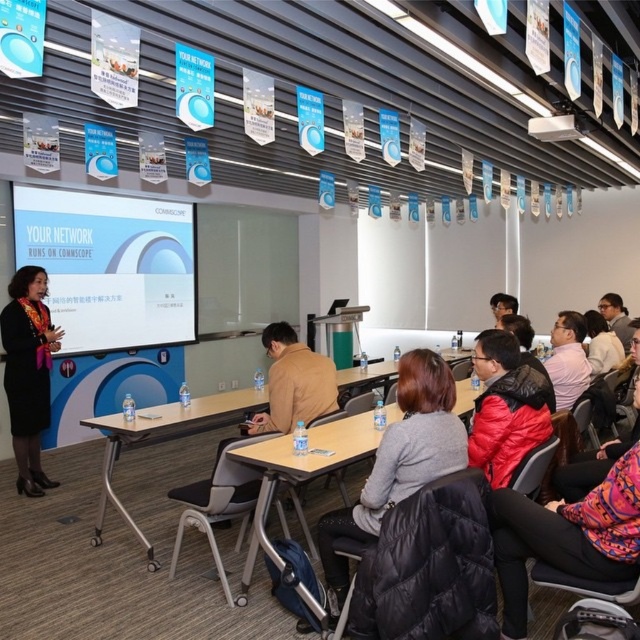
Question: Which point is farther to the camera?

Choices:
 (A) pink fabric shirt at center
 (B) metallic projector at upper center
 (C) wooden table at center
 (D) patterned fabric jacket at lower right

Answer: (B)

Question: Which object is closer to the camera taking this photo?

Choices:
 (A) light brown wooden table at center
 (B) black fabric dress at lower left

Answer: (A)

Question: Which of these objects is positioned farthest from the white glossy projection screen at center?

Choices:
 (A) metallic projector at upper center
 (B) pink fabric shirt at center
 (C) light brown wooden table at center
 (D) wooden table at center

Answer: (B)

Question: Where is wooden table at center located in relation to metallic projector at upper center in the image?

Choices:
 (A) left
 (B) right

Answer: (A)

Question: Does patterned fabric jacket at lower right have a lesser width compared to pink fabric shirt at center?

Choices:
 (A) no
 (B) yes

Answer: (A)

Question: Is red puffer jacket at center thinner than light brown wooden table at center?

Choices:
 (A) yes
 (B) no

Answer: (A)